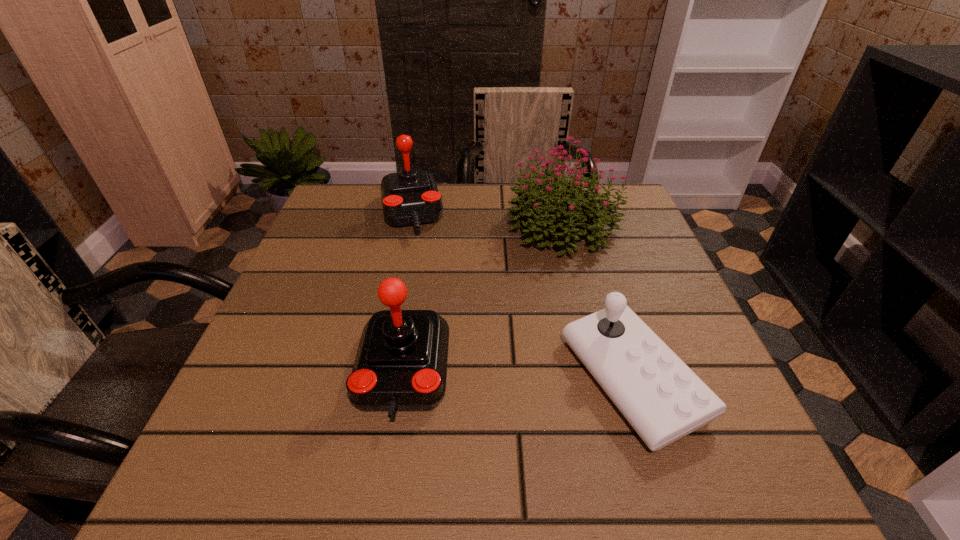
The width and height of the screenshot is (960, 540). What are the coordinates of `joystick that stands as the third closest to the bouquet` in the screenshot? It's located at (401, 363).